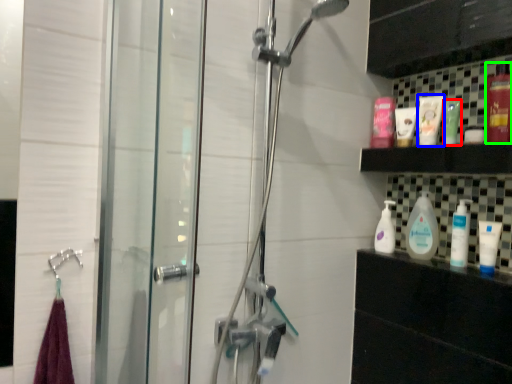
Question: Which is nearer to the mouthwash (highlighted by a red box)? toiletry (highlighted by a blue box) or mouthwash (highlighted by a green box).

Choices:
 (A) toiletry
 (B) mouthwash

Answer: (A)